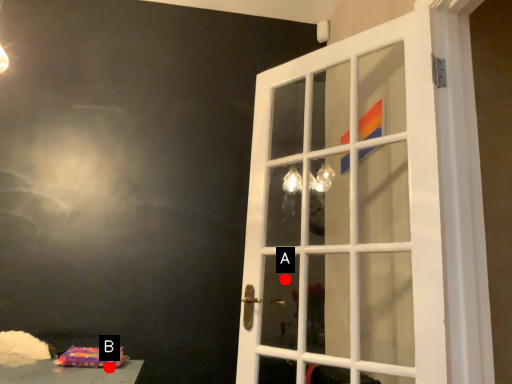
Question: Two points are circled on the image, labeled by A and B beside each circle. Which point appears closest to the camera in this image?

Choices:
 (A) A is closer
 (B) B is closer

Answer: (B)